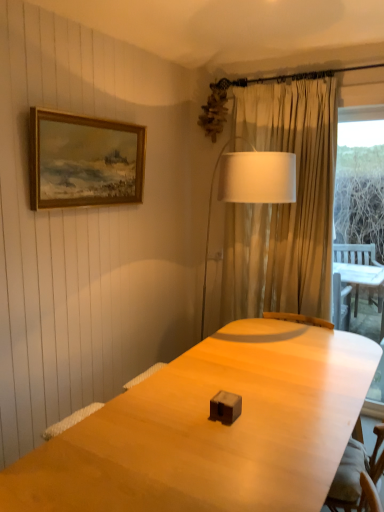
What do you see at coordinates (84, 161) in the screenshot? I see `wooden framed painting at upper left` at bounding box center [84, 161].

Locate an element on the screen. The height and width of the screenshot is (512, 384). wooden framed painting at upper left is located at coordinates pos(84,161).

What is the approximate height of white fabric lampshade at center?

It is 4.33 feet.

The image size is (384, 512). What do you see at coordinates (251, 184) in the screenshot?
I see `white fabric lampshade at center` at bounding box center [251, 184].

Where is `white fabric lampshade at center`? The width and height of the screenshot is (384, 512). white fabric lampshade at center is located at coordinates (251, 184).

The width and height of the screenshot is (384, 512). Find the location of `wooden framed painting at upper left`. wooden framed painting at upper left is located at coordinates (84, 161).

In the scene shown: Is wooden framed painting at upper left at the right side of white fabric lampshade at center?

In fact, wooden framed painting at upper left is to the left of white fabric lampshade at center.

Which object is further away from the camera, wooden framed painting at upper left or white fabric lampshade at center?

white fabric lampshade at center is further away from the camera.

Considering the positions of points (94, 156) and (270, 165), is point (94, 156) closer to camera compared to point (270, 165)?

No, it is not.

From the image's perspective, does wooden framed painting at upper left appear higher than white fabric lampshade at center?

Yes, from the image's perspective, wooden framed painting at upper left is over white fabric lampshade at center.

From a real-world perspective, relative to white fabric lampshade at center, is wooden framed painting at upper left vertically above or below?

From a real-world perspective, wooden framed painting at upper left is physically above white fabric lampshade at center.

In terms of width, does wooden framed painting at upper left look wider or thinner when compared to white fabric lampshade at center?

wooden framed painting at upper left is thinner than white fabric lampshade at center.

Who is taller, wooden framed painting at upper left or white fabric lampshade at center?

Standing taller between the two is white fabric lampshade at center.

Which of these two, wooden framed painting at upper left or white fabric lampshade at center, is bigger?

Bigger between the two is white fabric lampshade at center.

Is wooden framed painting at upper left completely or partially outside of white fabric lampshade at center?

Yes, wooden framed painting at upper left is outside of white fabric lampshade at center.

Can you see wooden framed painting at upper left touching white fabric lampshade at center?

wooden framed painting at upper left and white fabric lampshade at center are not in contact.

Is wooden framed painting at upper left oriented away from white fabric lampshade at center?

wooden framed painting at upper left is not turned away from white fabric lampshade at center.

In order to click on picture frame that appears in front of the white fabric lampshade at center in this screenshot , I will do `click(84, 161)`.

Which object is positioned more to the left, white fabric lampshade at center or wooden framed painting at upper left?

wooden framed painting at upper left is more to the left.

Relative to wooden framed painting at upper left, is white fabric lampshade at center in front or behind?

white fabric lampshade at center is behind wooden framed painting at upper left.

Considering the positions of points (242, 166) and (35, 183), is point (242, 166) farther from camera compared to point (35, 183)?

Yes, it is behind point (35, 183).

From the image's perspective, does white fabric lampshade at center appear lower than wooden framed painting at upper left?

Yes.

From a real-world perspective, is white fabric lampshade at center on wooden framed painting at upper left?

Incorrect, from a real-world perspective, white fabric lampshade at center is lower than wooden framed painting at upper left.

Can you confirm if white fabric lampshade at center is thinner than wooden framed painting at upper left?

Incorrect, the width of white fabric lampshade at center is not less than that of wooden framed painting at upper left.

Can you confirm if white fabric lampshade at center is taller than wooden framed painting at upper left?

Correct, white fabric lampshade at center is much taller as wooden framed painting at upper left.

Between white fabric lampshade at center and wooden framed painting at upper left, which one has larger size?

white fabric lampshade at center.

Is white fabric lampshade at center completely or partially outside of wooden framed painting at upper left?

Yes.

Would you say white fabric lampshade at center is a long distance from wooden framed painting at upper left?

No, there isn't a large distance between white fabric lampshade at center and wooden framed painting at upper left.

Is white fabric lampshade at center positioned with its back to wooden framed painting at upper left?

No, white fabric lampshade at center's orientation is not away from wooden framed painting at upper left.

Identify the location of picture frame on the left of white fabric lampshade at center. (84, 161).

Locate an element on the screen. Image resolution: width=384 pixels, height=512 pixels. table lamp directly beneath the wooden framed painting at upper left (from a real-world perspective) is located at coordinates (251, 184).

Find the location of a particular element. picture frame located on the left of white fabric lampshade at center is located at coordinates (84, 161).